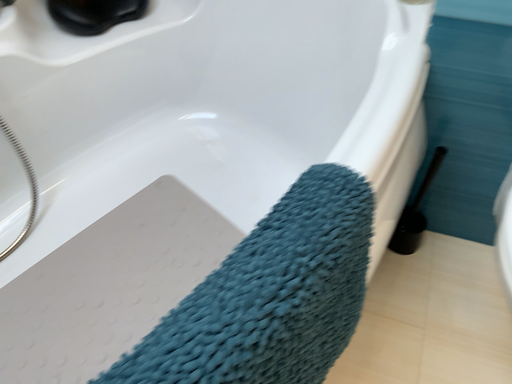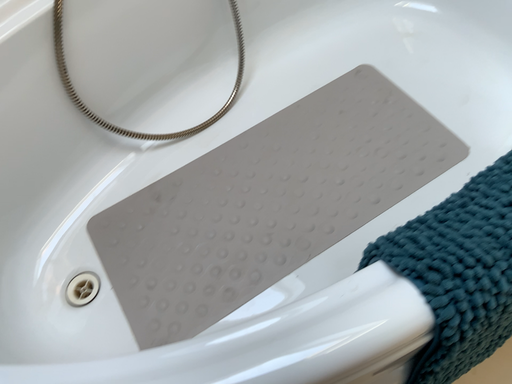
Question: How did the camera likely rotate when shooting the video?

Choices:
 (A) rotated right
 (B) rotated left

Answer: (B)